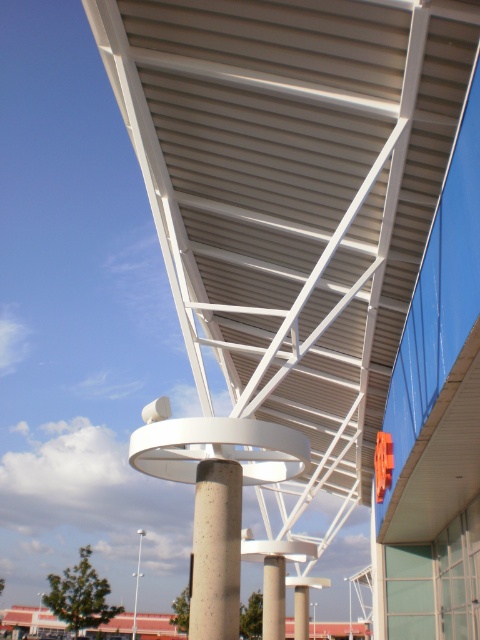
Question: Among these objects, which one is farthest from the camera?

Choices:
 (A) white concrete pole at center
 (B) concrete pillar at center
 (C) concrete textured column at center
 (D) white metal roof at center

Answer: (A)

Question: Can you confirm if concrete column at center is wider than white concrete pole at center?

Choices:
 (A) no
 (B) yes

Answer: (A)

Question: Does white metal roof at center appear on the right side of concrete column at center?

Choices:
 (A) yes
 (B) no

Answer: (A)

Question: Which point is closer to the camera taking this photo?

Choices:
 (A) (134, 602)
 (B) (265, 566)
 (C) (374, 145)
 (D) (298, 616)

Answer: (C)

Question: Which point is farther from the camera taking this photo?

Choices:
 (A) (371, 294)
 (B) (301, 598)
 (C) (134, 634)

Answer: (C)

Question: Can you confirm if concrete column at center is positioned below white concrete pole at center?

Choices:
 (A) no
 (B) yes

Answer: (A)